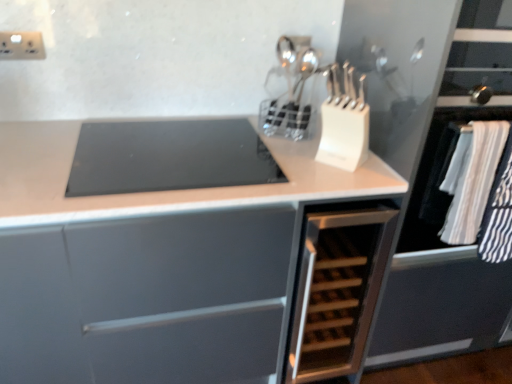
At what (x,y) coordinates should I click in order to perform the action: click on vacant space to the left of white plastic knife block at upper center. Please return your answer as a coordinate pair (x, y). The height and width of the screenshot is (384, 512). Looking at the image, I should click on click(x=283, y=163).